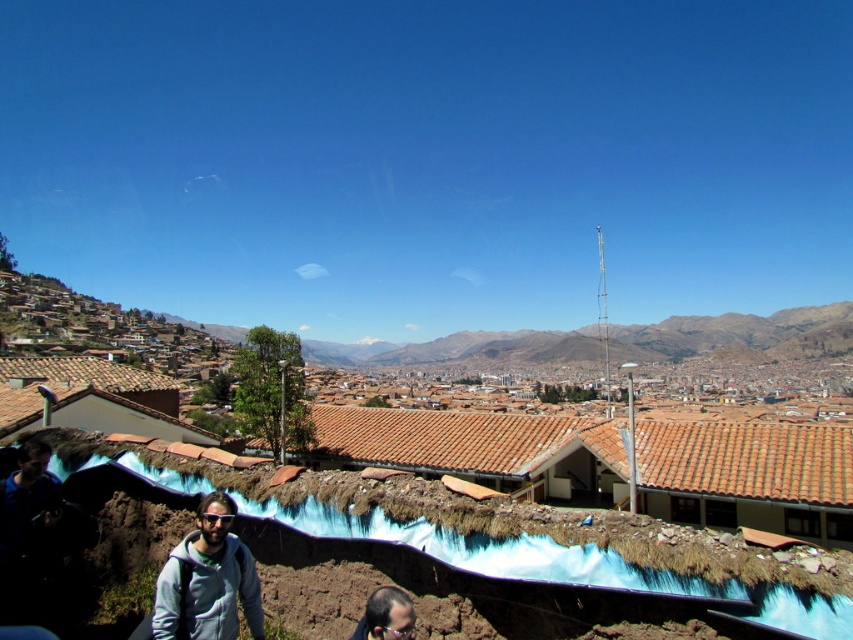
Question: Which object appears closest to the camera in this image?

Choices:
 (A) gray fleece jacket at lower center
 (B) smooth brown hair at lower center

Answer: (B)

Question: Does gray fleece jacket at lower center have a larger size compared to smooth brown hair at lower center?

Choices:
 (A) yes
 (B) no

Answer: (A)

Question: Can you confirm if gray fleece jacket at lower center is positioned to the right of smooth brown hair at lower center?

Choices:
 (A) no
 (B) yes

Answer: (A)

Question: Is gray fleece jacket at lower center further to camera compared to smooth brown hair at lower center?

Choices:
 (A) no
 (B) yes

Answer: (B)

Question: Among these objects, which one is nearest to the camera?

Choices:
 (A) gray fleece jacket at lower center
 (B) smooth brown hair at lower center

Answer: (B)